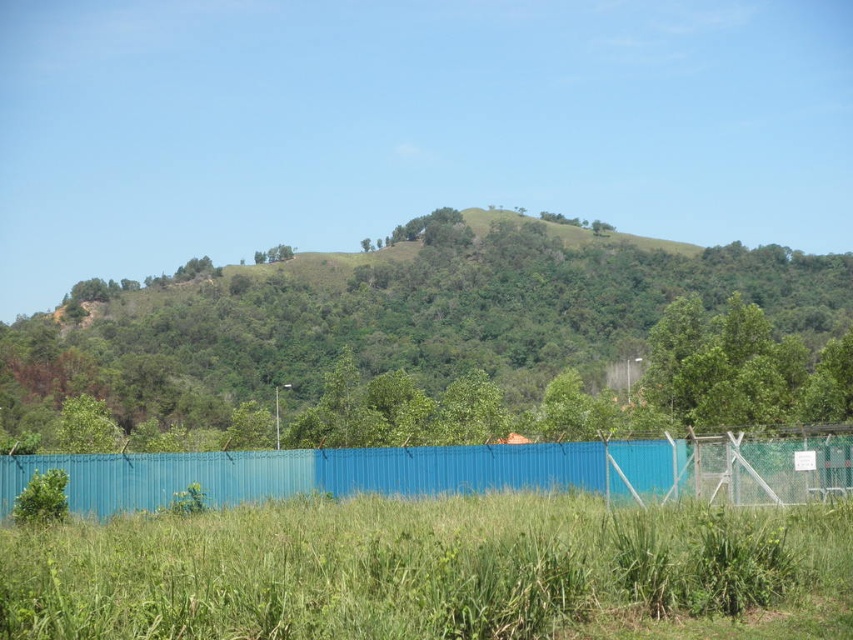
Question: Which of the following is the closest to the observer?

Choices:
 (A) (90, 328)
 (B) (697, 632)
 (C) (788, 452)

Answer: (B)

Question: Estimate the real-world distances between objects in this image. Which object is closer to the blue corrugated metal fence at lower center?

Choices:
 (A) green grassy at lower center
 (B) green leafy tree at center

Answer: (A)

Question: Is green grassy at lower center positioned before blue corrugated metal fence at lower center?

Choices:
 (A) yes
 (B) no

Answer: (A)

Question: Which of the following is the closest to the observer?

Choices:
 (A) green grassy at lower center
 (B) green leafy tree at center

Answer: (A)

Question: Can you confirm if green grassy at lower center is smaller than blue corrugated metal fence at lower center?

Choices:
 (A) yes
 (B) no

Answer: (B)

Question: From the image, what is the correct spatial relationship of green leafy tree at center in relation to blue corrugated metal fence at lower center?

Choices:
 (A) below
 (B) above

Answer: (B)